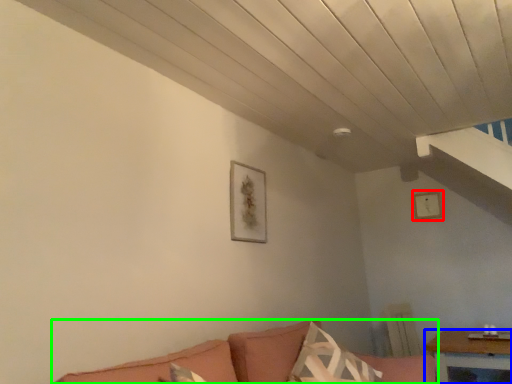
Question: Which is farther away from picture frame (highlighted by a red box)? table (highlighted by a blue box) or studio couch (highlighted by a green box)?

Choices:
 (A) table
 (B) studio couch

Answer: (B)